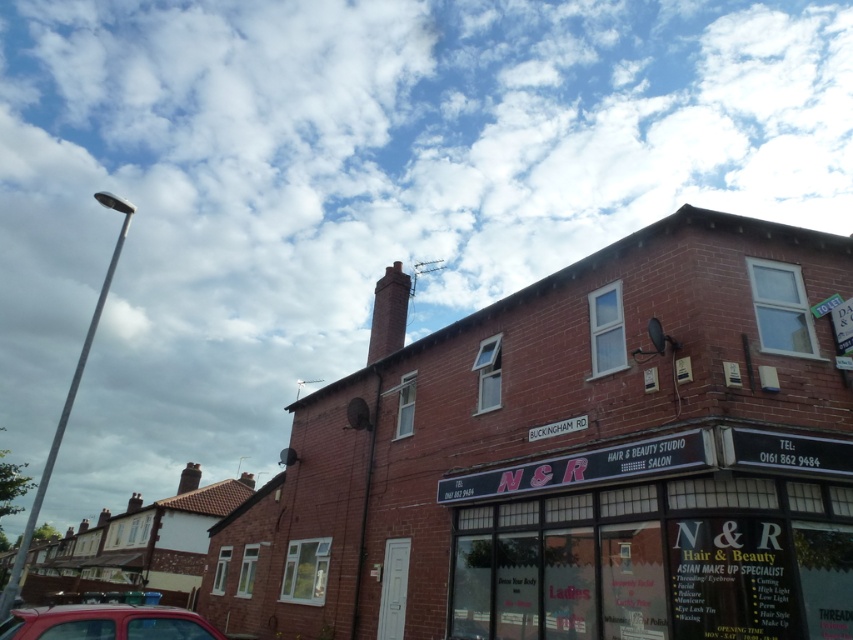
What is the 2D coordinate of the brick building at center?

The brick building at center is located at the 2D coordinate point of [578,460].

You are standing in front of the building and want to take a photo of the entrance door. The matte red car at lower left and the red brick chimney at upper center are blocking your view. Which object should you move to get a clear shot of the entrance door?

You should move the matte red car at lower left because it is closer to the viewer than the red brick chimney at upper center and is blocking the entrance door.